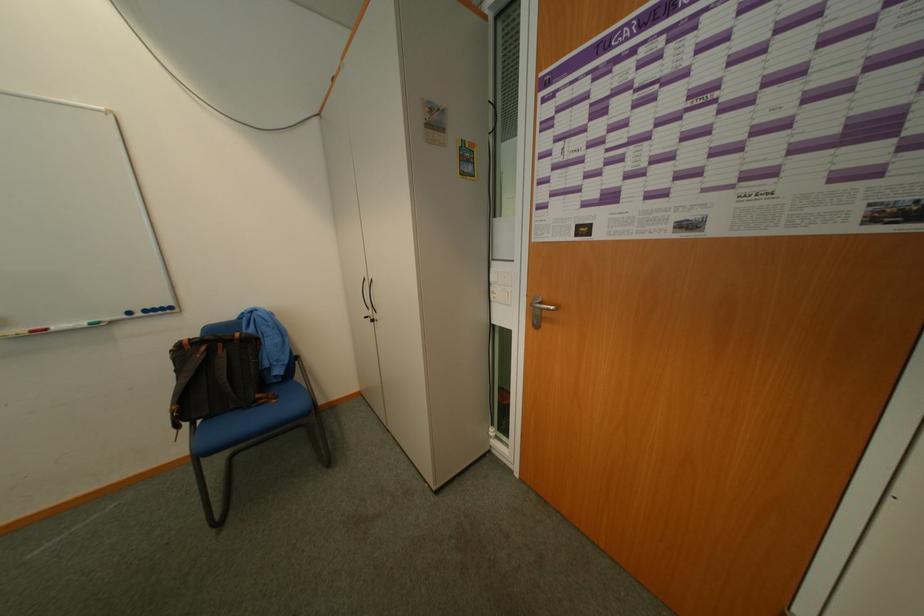
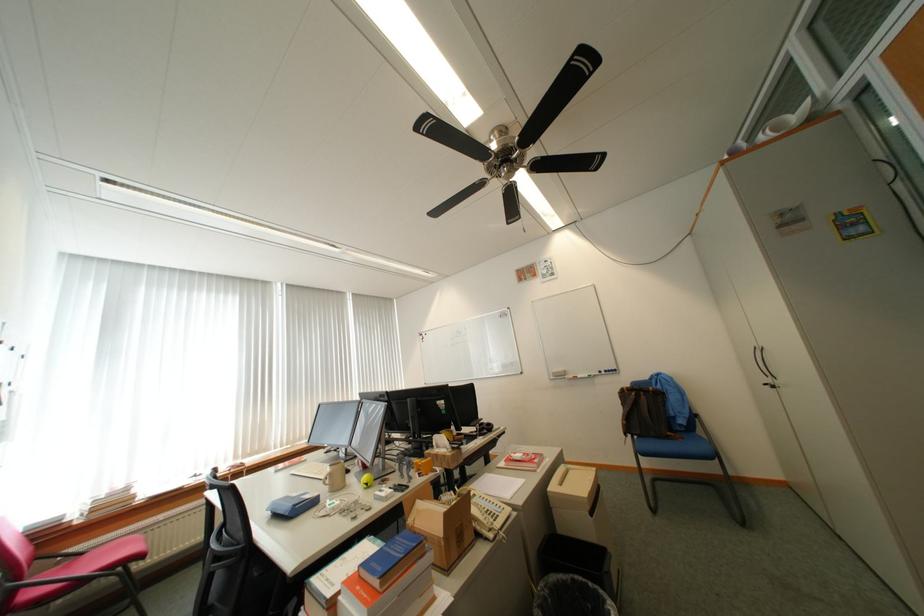
The point at (x=202, y=426) is marked in the first image. Where is the corresponding point in the second image?

(641, 438)